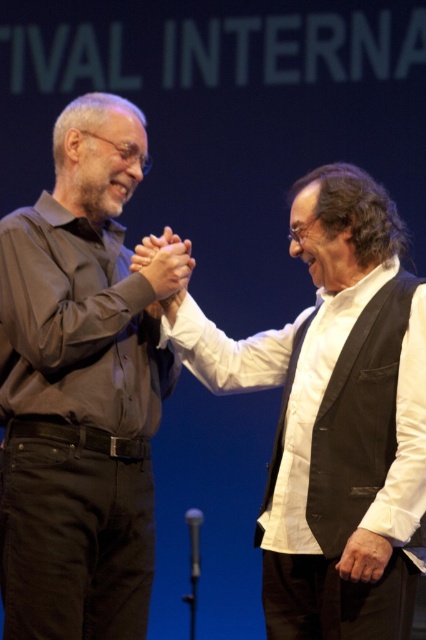
Does matte black shirt at left have a larger size compared to matte brown hands at center?

Yes.

Is point (60, 273) positioned behind point (176, 291)?

No, it is not.

Who is more forward, (103, 483) or (187, 276)?

Point (103, 483)

Find the location of a particular element. The height and width of the screenshot is (640, 426). matte black shirt at left is located at coordinates 78,392.

Does matte black shirt at left appear under white shirt at center?

No.

Who is higher up, matte black shirt at left or white shirt at center?

matte black shirt at left is above.

The height and width of the screenshot is (640, 426). What are the coordinates of `matte black shirt at left` in the screenshot? It's located at (78, 392).

Identify the location of matte black shirt at left. This screenshot has height=640, width=426. (78, 392).

Is white shirt at center smaller than matte brown hands at center?

Incorrect, white shirt at center is not smaller in size than matte brown hands at center.

Is white shirt at center above matte brown hands at center?

No, white shirt at center is not above matte brown hands at center.

Who is more forward, (317, 241) or (169, 257)?

Point (317, 241) is in front.

This screenshot has height=640, width=426. Find the location of `white shirt at center`. white shirt at center is located at coordinates (334, 417).